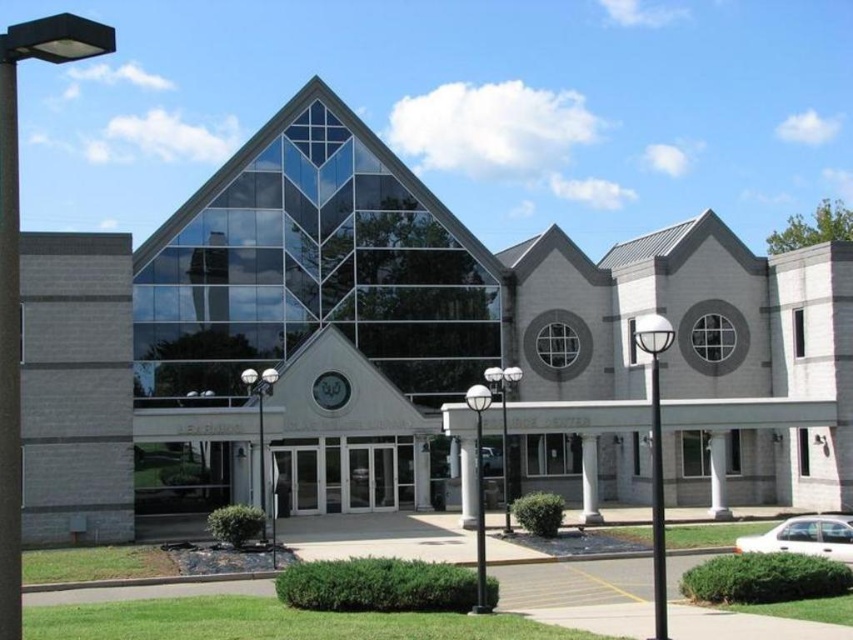
You are standing 150 feet away from the modern building. You want to reach the point at coordinates point (x=471, y=445) on the building. Can you walk directly to that point from your current position?

The distance of point (x=471, y=445) from viewer is 171.27 feet, so you are currently 150 feet away and would need to move an additional 21.27 feet closer to reach the point.

You are standing in front of the modern building and want to locate the white marble pillar at center. Based on the 2D coordinates provided, can you determine its position relative to the building?

The white marble pillar at center is located at coordinates approximately 0.752 on the x axis and 0.692 on the y axis, which places it near the lower right side of the building structure.

You are an architect designing a new plaza and want to ensure that the clear glass building at center and the white marble pillar at center will fit within a 10 meter wide space. Given their relative sizes, can both objects fit side by side without overlapping?

Result: The clear glass building at center is wider than the white marble pillar at center. To determine if they can fit side by side within 10 meters, we need to know their exact widths. Since the description only states the building is wider than the pillar but doesn